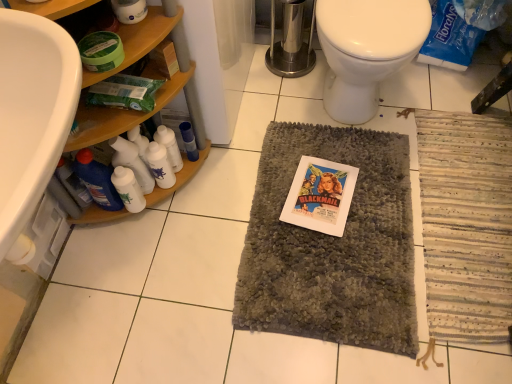
Question: From a real-world perspective, relative to blue glossy bottle at lower left, which is the 5th bottle from right to left, is white plastic bottles at left, placed as the fourth bottle when sorted from left to right, vertically above or below?

Choices:
 (A) above
 (B) below

Answer: (B)

Question: In terms of width, does white plastic bottles at left, which is the 2th bottle in right-to-left order, look wider or thinner when compared to blue glossy bottle at lower left, which is the 5th bottle from right to left?

Choices:
 (A) thin
 (B) wide

Answer: (A)

Question: Which is nearer to the gray shaggy mat at center?

Choices:
 (A) woodenshelves at left
 (B) striped fabric bath mat at lower right
 (C) white plastic bottles at left, placed as the fourth bottle when sorted from left to right
 (D) white glossy bottles at left, the 3th bottle in the left-to-right sequence
 (E) white glossy bottle at lower left, the second bottle in the left-to-right sequence

Answer: (B)

Question: Estimate the real-world distances between objects in this image. Which object is closer to the white glossy bottles at left, which is the 3th bottle from right to left?

Choices:
 (A) gray shaggy mat at center
 (B) matte paper comic book at center
 (C) white glossy bottle at lower left, the second bottle in the left-to-right sequence
 (D) woodenshelves at left
 (E) white plastic bottles at left, placed as the fourth bottle when sorted from left to right

Answer: (E)